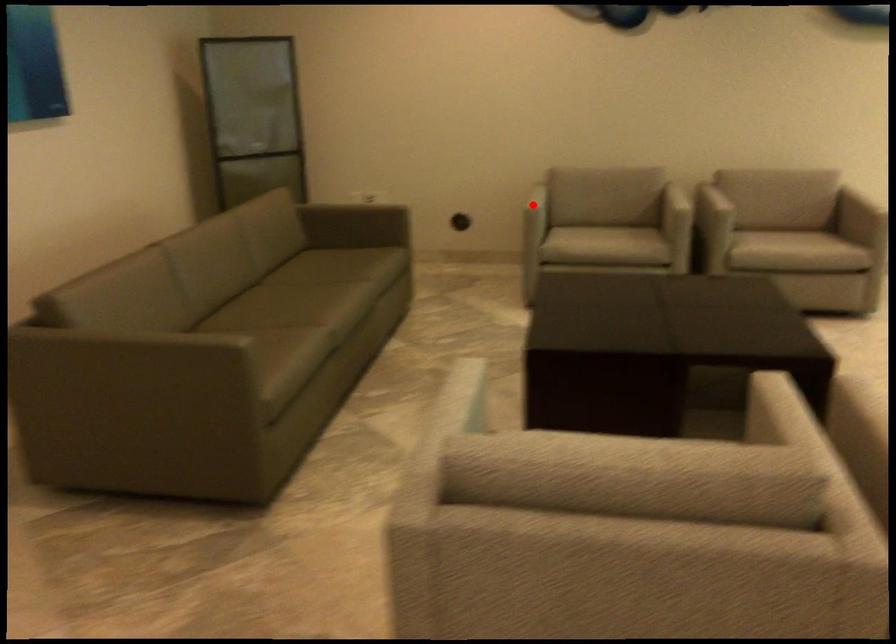
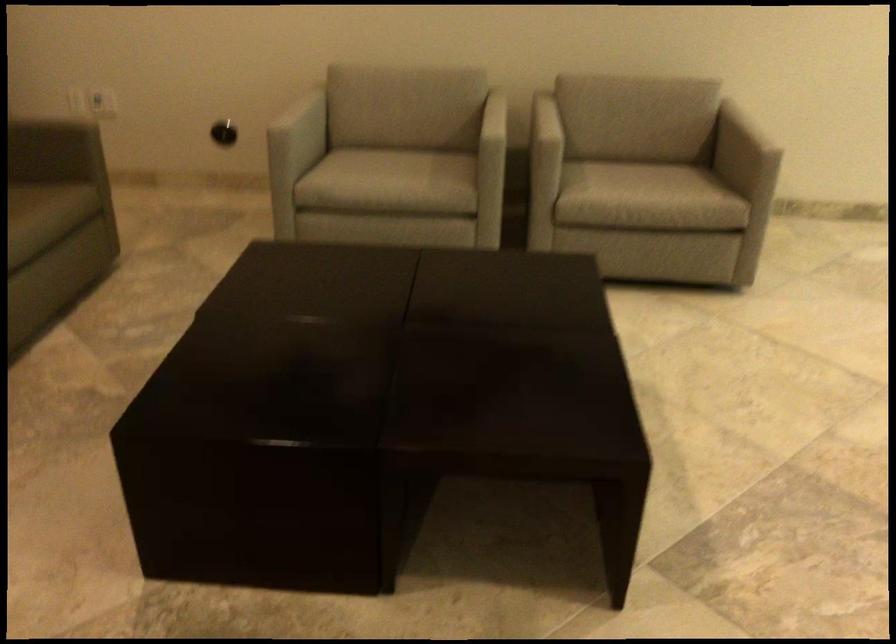
Question: I am providing you with two images of the same scene from different viewpoints. Image1 has a red point marked. In image2, the corresponding 3D location appears at what relative position? Reply with the corresponding letter.

Choices:
 (A) Closer
 (B) Farther

Answer: (A)